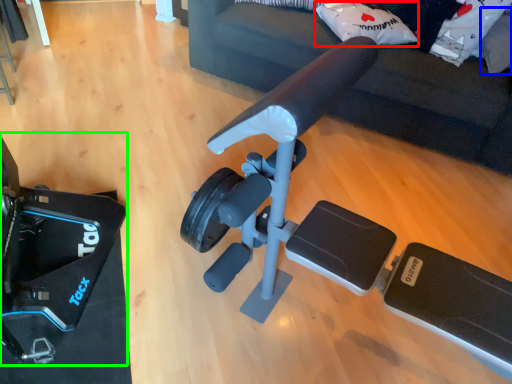
Question: Which object is positioned closest to pillow (highlighted by a red box)? Select from pillow (highlighted by a blue box) and video camera (highlighted by a green box).

Choices:
 (A) pillow
 (B) video camera

Answer: (A)